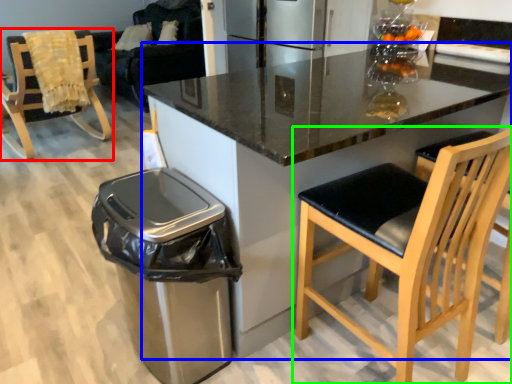
Question: Which object is positioned farthest from chair (highlighted by a red box)? Select from countertop (highlighted by a blue box) and chair (highlighted by a green box).

Choices:
 (A) countertop
 (B) chair

Answer: (B)